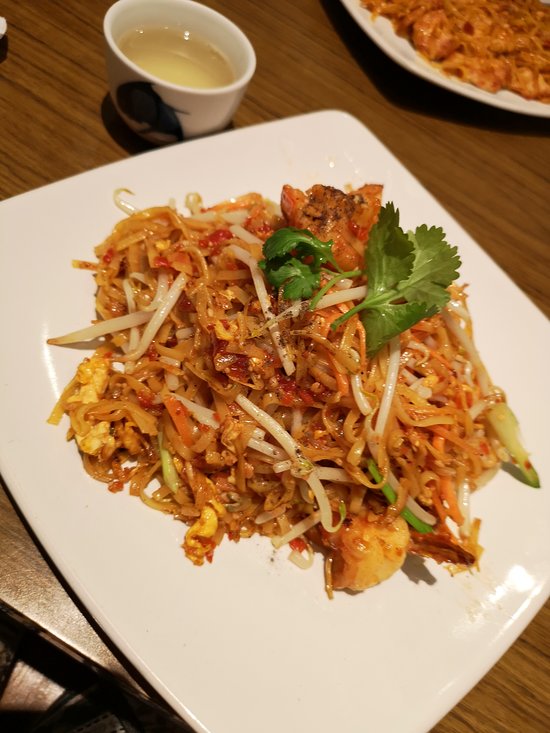
Where is `ramekin`? The width and height of the screenshot is (550, 733). ramekin is located at coordinates pos(205,105).